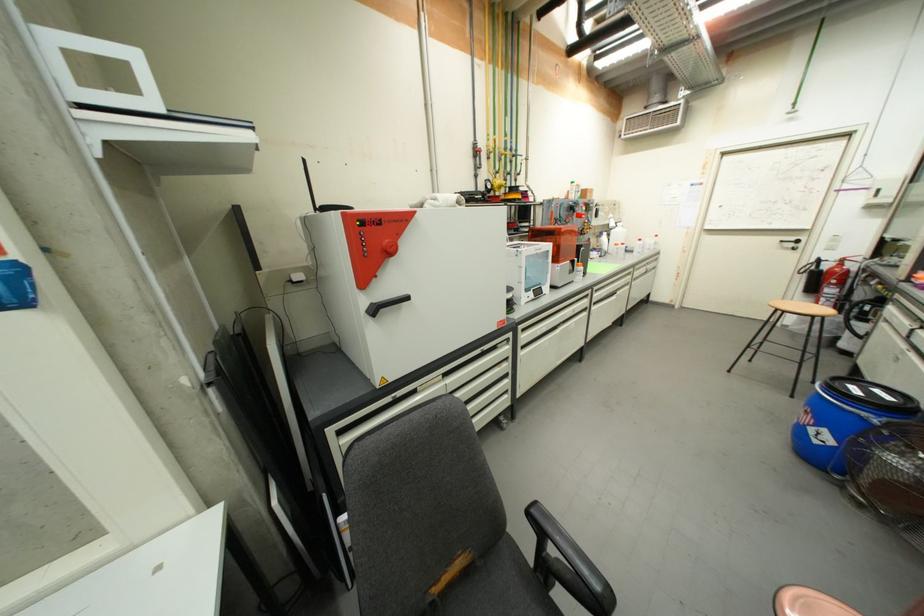
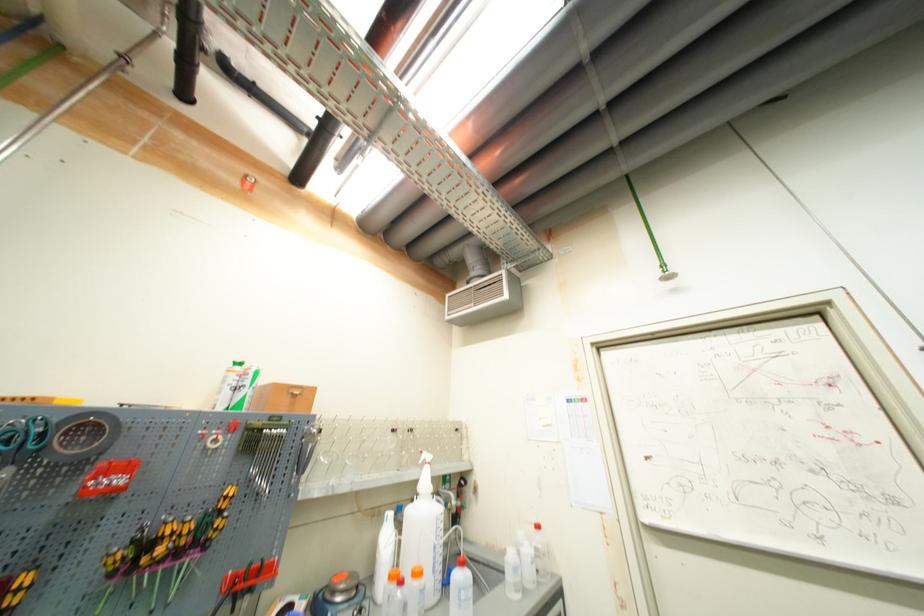
Find the pixel in the second image that matches point (658, 249) in the first image.

(533, 578)